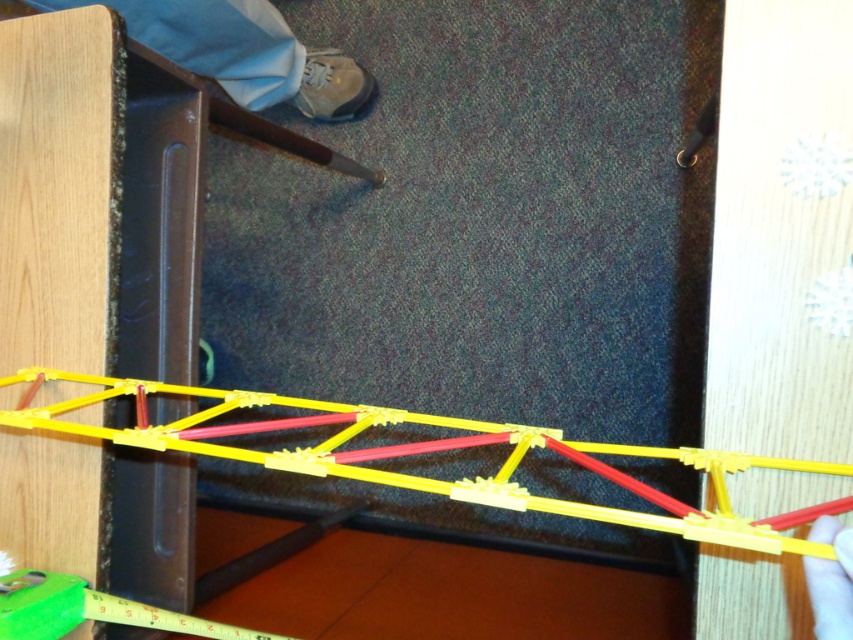
Question: Is the position of light blue fabric pants at lower left more distant than that of smooth plastic hand at lower right?

Choices:
 (A) yes
 (B) no

Answer: (A)

Question: Which point is farther to the camera?

Choices:
 (A) smooth plastic hand at lower right
 (B) yellow plastic bridge at center
 (C) light blue fabric pants at lower left

Answer: (C)

Question: Is light blue fabric pants at lower left to the left of smooth plastic hand at lower right from the viewer's perspective?

Choices:
 (A) yes
 (B) no

Answer: (A)

Question: Observing the image, what is the correct spatial positioning of yellow plastic bridge at center in reference to light blue fabric pants at lower left?

Choices:
 (A) left
 (B) right

Answer: (B)

Question: Which point is closer to the camera?

Choices:
 (A) (730, 513)
 (B) (846, 540)

Answer: (B)

Question: Which object is the closest to the smooth plastic hand at lower right?

Choices:
 (A) light blue fabric pants at lower left
 (B) yellow plastic bridge at center

Answer: (B)